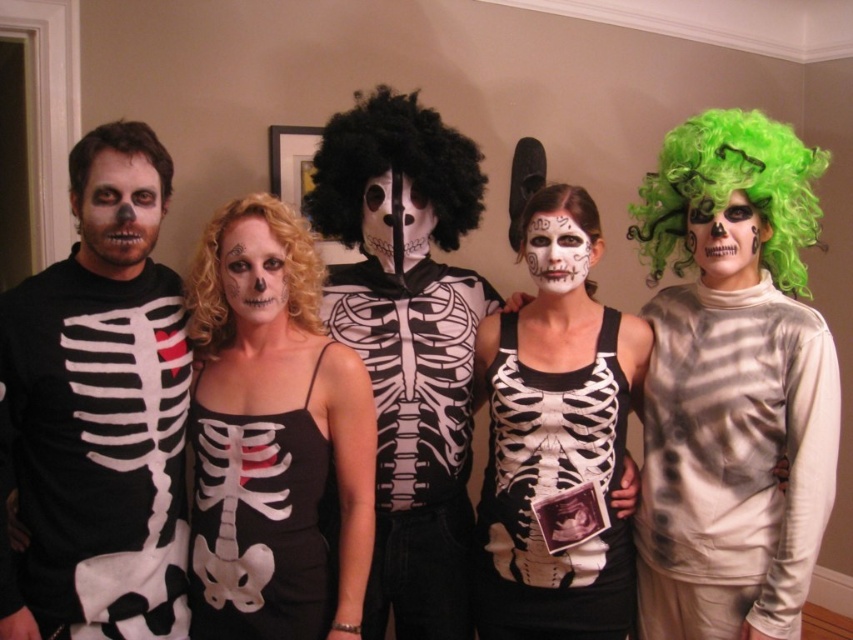
Question: Which point is farther from the camera taking this photo?

Choices:
 (A) (788, 196)
 (B) (108, 554)
 (C) (276, 314)

Answer: (A)

Question: Considering the real-world distances, which object is closest to the curly blonde wig at center?

Choices:
 (A) matte black tank top at center
 (B) dark brown curly wig at left
 (C) matte black dress at center
 (D) matte black face paint at center

Answer: (D)

Question: Is matte green wig at upper right wider than white matte face paint at center?

Choices:
 (A) no
 (B) yes

Answer: (B)

Question: Is black curly wig at center bigger than curly blonde wig at center?

Choices:
 (A) yes
 (B) no

Answer: (A)

Question: Among these points, which one is nearest to the camera?

Choices:
 (A) (482, 488)
 (B) (241, 234)
 (C) (141, 193)
 (D) (90, 184)

Answer: (D)

Question: Can you confirm if black curly wig at center is bigger than curly blonde wig at center?

Choices:
 (A) no
 (B) yes

Answer: (B)